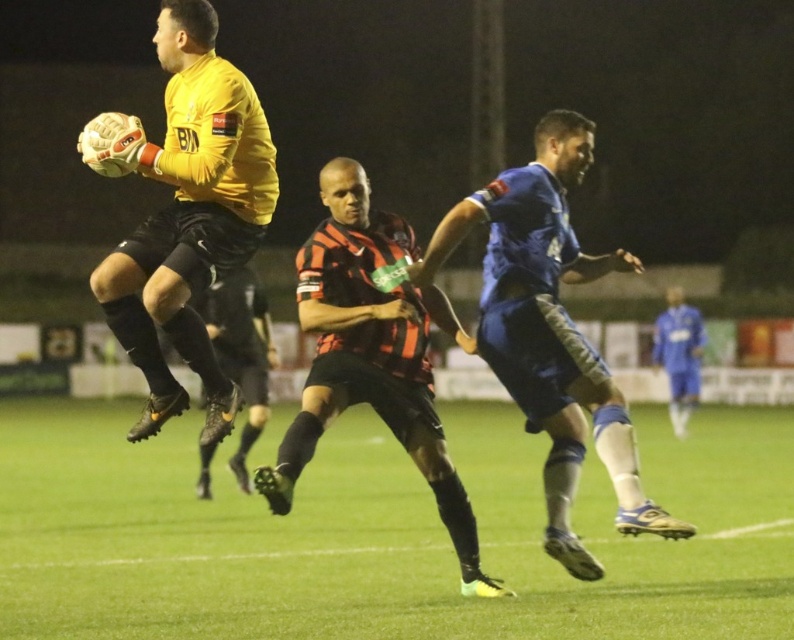
You are a soccer coach analyzing the match. You want to determine the exact location of the green grass at center during this play. What are its coordinates?

The green grass at center is located at coordinates point (384,532).

You are a soccer referee observing the match. You need to determine if the ball is within the field boundaries. The field boundaries are marked by white lines on the green grass at center. Where is the ball located relative to the blue fabric shorts at center?

The green grass at center is below blue fabric shorts at center, so the ball is on the field since it is on the green grass at center which is within the field boundaries marked by white lines.